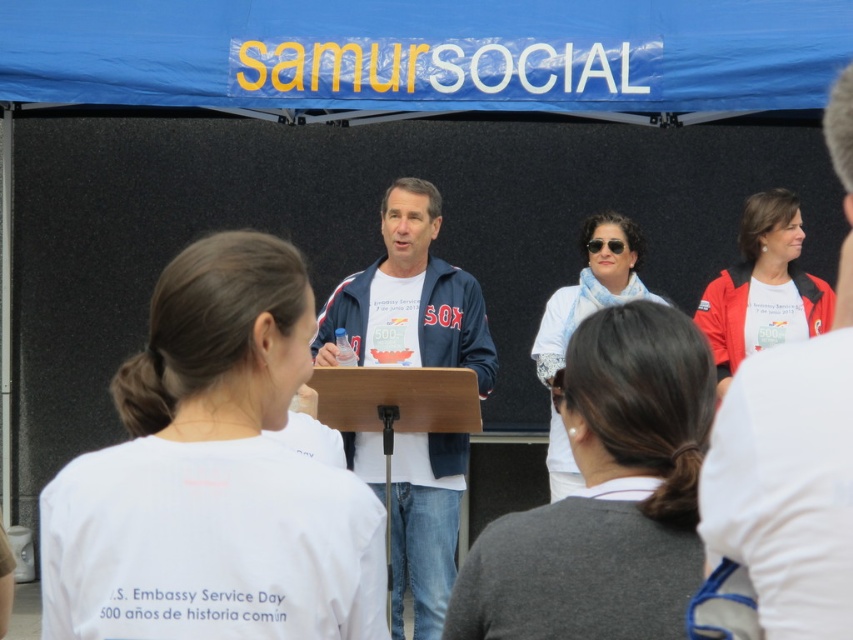
Question: Considering the relative positions of matte blue jacket at center and white scarf at center in the image provided, where is matte blue jacket at center located with respect to white scarf at center?

Choices:
 (A) left
 (B) right

Answer: (A)

Question: Which point is farther to the camera?

Choices:
 (A) white cotton t-shirt at center
 (B) white matte jacket at upper right

Answer: (B)

Question: From the image, what is the correct spatial relationship of white cotton t-shirt at center in relation to blue denim jacket at center?

Choices:
 (A) right
 (B) left

Answer: (B)

Question: Which point is closer to the camera taking this photo?

Choices:
 (A) click(x=746, y=390)
 (B) click(x=431, y=346)

Answer: (A)

Question: Which point is farther from the camera taking this photo?

Choices:
 (A) (410, 218)
 (B) (799, 588)
 (C) (271, 596)

Answer: (A)

Question: Is gray sweater at center in front of blue denim jacket at center?

Choices:
 (A) yes
 (B) no

Answer: (A)